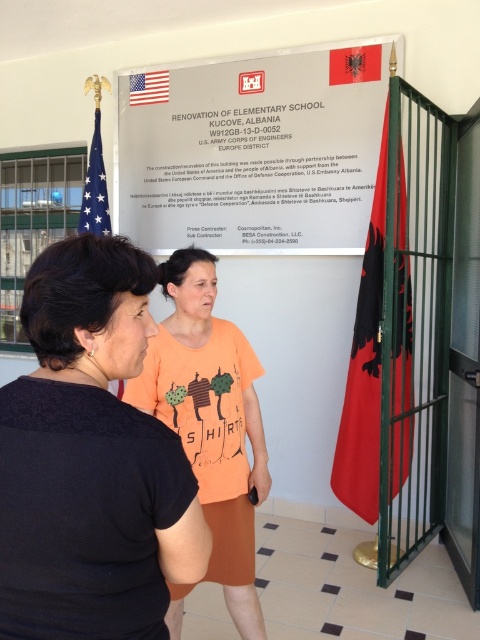
Question: Can you confirm if black matte shirt at center is wider than red fabric flag at right?

Choices:
 (A) yes
 (B) no

Answer: (B)

Question: Can you confirm if orange cotton shirt at center is positioned to the right of blue fabric flag at upper left?

Choices:
 (A) no
 (B) yes

Answer: (B)

Question: Which object is closer to the camera taking this photo?

Choices:
 (A) american flag at upper left
 (B) black matte shirt at center
 (C) white paper at center
 (D) red fabric flag at right

Answer: (B)

Question: Which of the following is the farthest from the observer?

Choices:
 (A) (321, 240)
 (B) (211, 435)
 (C) (48, 348)

Answer: (A)

Question: Is white paper at center above american flag at upper left?

Choices:
 (A) yes
 (B) no

Answer: (B)

Question: Which point is farther to the camera?

Choices:
 (A) black matte shirt at center
 (B) red fabric flag at right

Answer: (B)